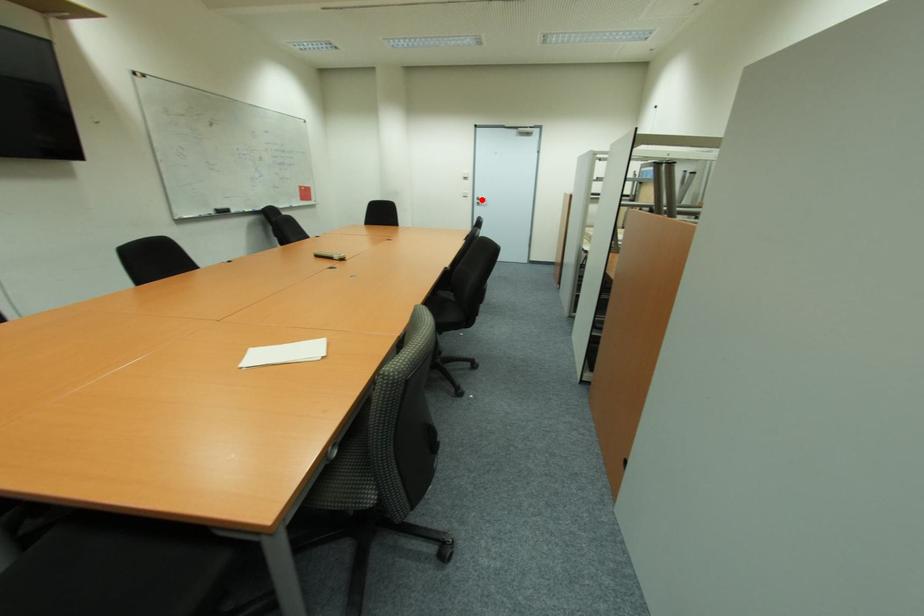
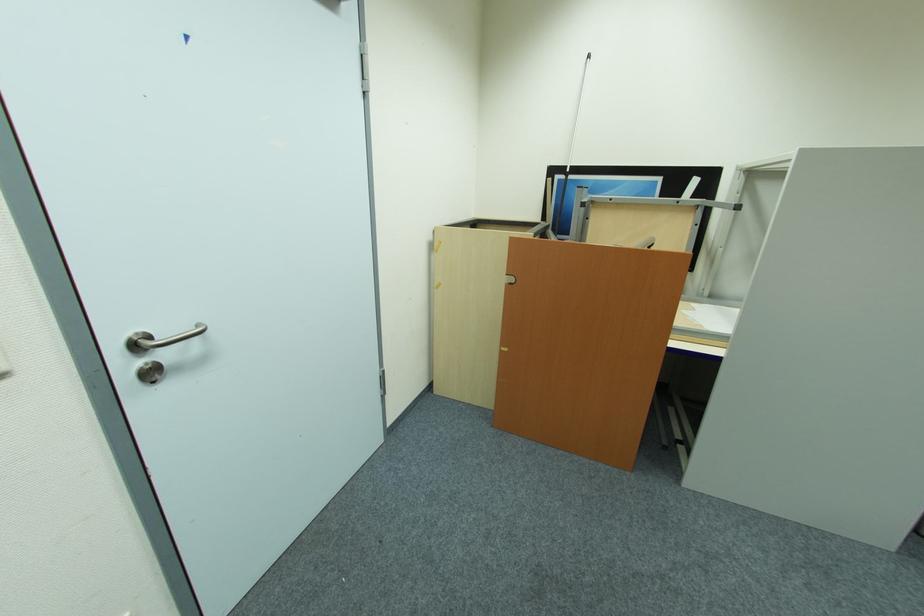
Question: I am providing you with two images of the same scene from different viewpoints. A red point is marked on the first image. Is the red point's position out of view in image 2?

Choices:
 (A) Yes
 (B) No

Answer: (B)